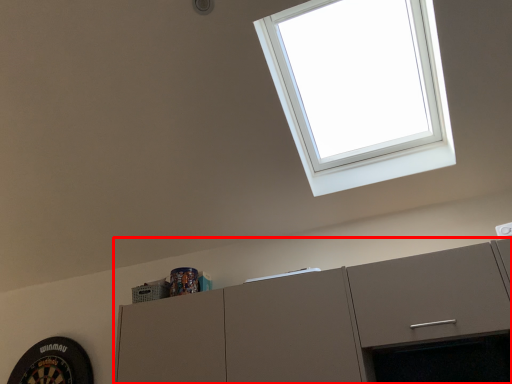
Question: Where is cabinetry (annotated by the red box) located in relation to window in the image?

Choices:
 (A) left
 (B) right

Answer: (A)